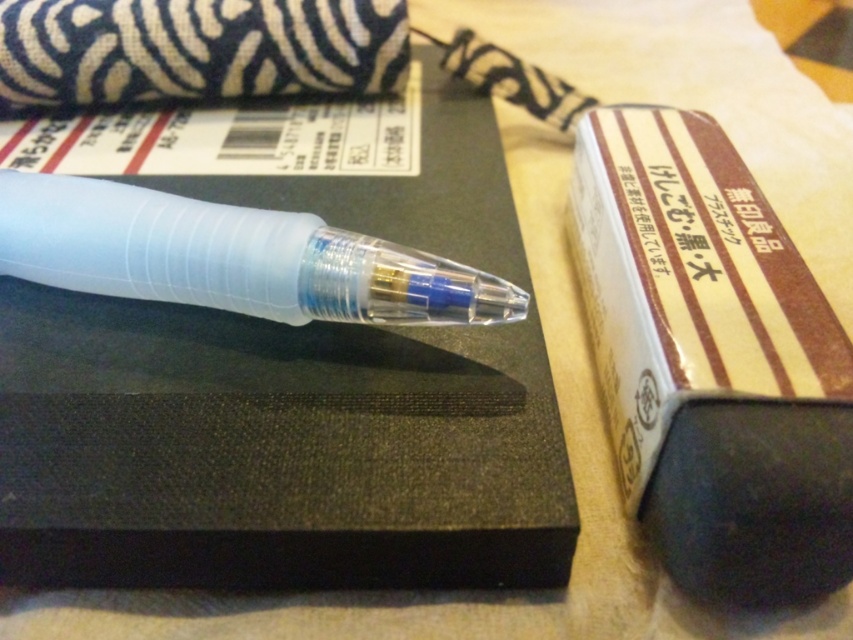
Is black matte notebook at center taller than translucent plastic pen at center?

Correct, black matte notebook at center is much taller as translucent plastic pen at center.

Identify the location of black matte notebook at center. Image resolution: width=853 pixels, height=640 pixels. (273, 451).

I want to click on black matte notebook at center, so click(x=273, y=451).